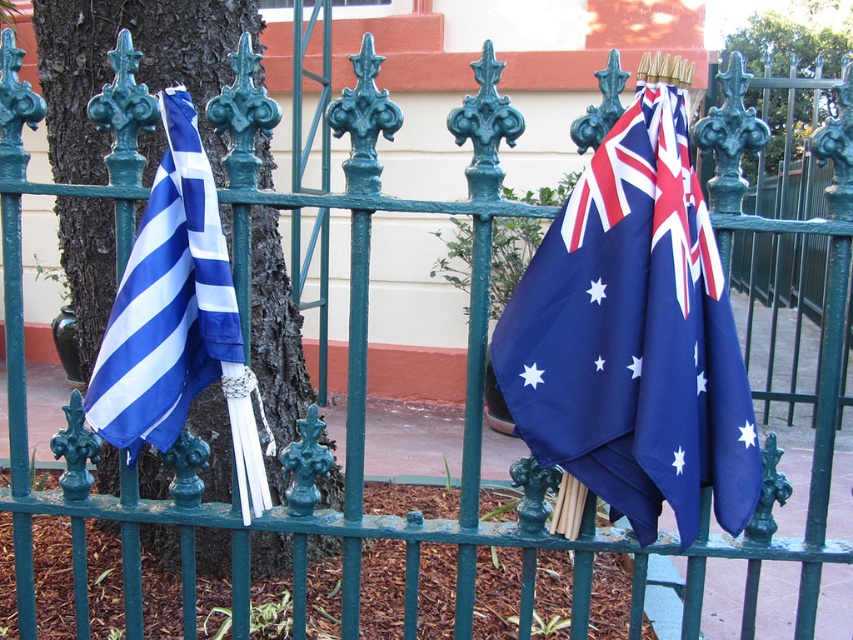
Question: Does navy blue fabric flag at center have a smaller size compared to blue/white striped fabric at left?

Choices:
 (A) yes
 (B) no

Answer: (B)

Question: Can you confirm if navy blue fabric flag at center is thinner than blue/white striped fabric at left?

Choices:
 (A) yes
 (B) no

Answer: (B)

Question: Which point is closer to the camera?

Choices:
 (A) navy blue fabric flag at center
 (B) blue/white striped fabric at left

Answer: (A)

Question: Which object appears farthest from the camera in this image?

Choices:
 (A) blue/white striped fabric at left
 (B) navy blue fabric flag at center

Answer: (A)

Question: Does navy blue fabric flag at center appear over blue/white striped fabric at left?

Choices:
 (A) yes
 (B) no

Answer: (B)